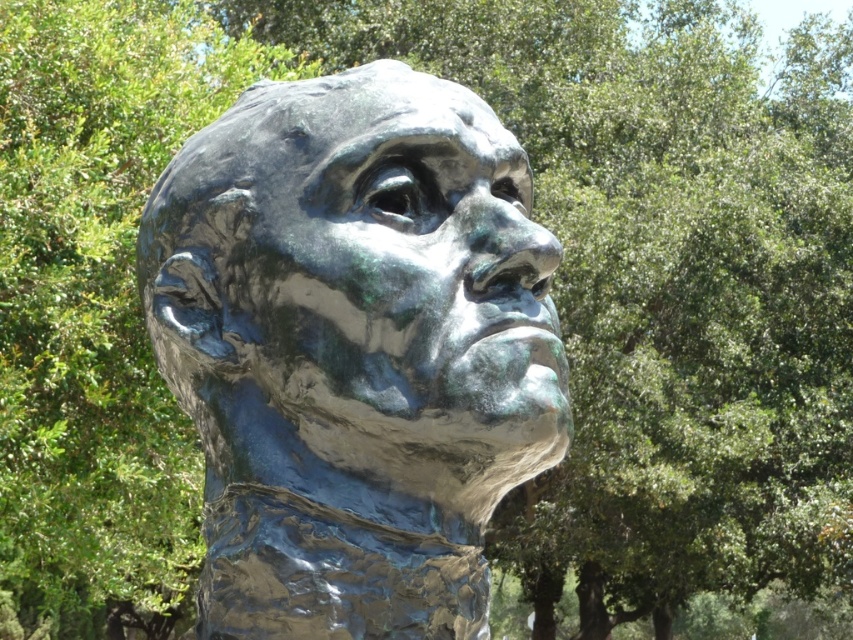
Between green patina bronze head at center and green patina sculpture at center, which one has more height?

Standing taller between the two is green patina bronze head at center.

Find the location of `green patina bronze head at center`. green patina bronze head at center is located at coordinates (354, 349).

Who is more forward, (547, 467) or (521, 276)?

Point (521, 276) is in front.

This screenshot has width=853, height=640. I want to click on green patina bronze head at center, so click(x=354, y=349).